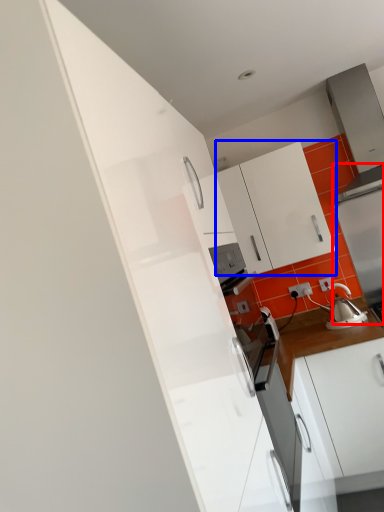
Question: Which object is further to the camera taking this photo, appliance (highlighted by a red box) or cabinetry (highlighted by a blue box)?

Choices:
 (A) appliance
 (B) cabinetry

Answer: (A)